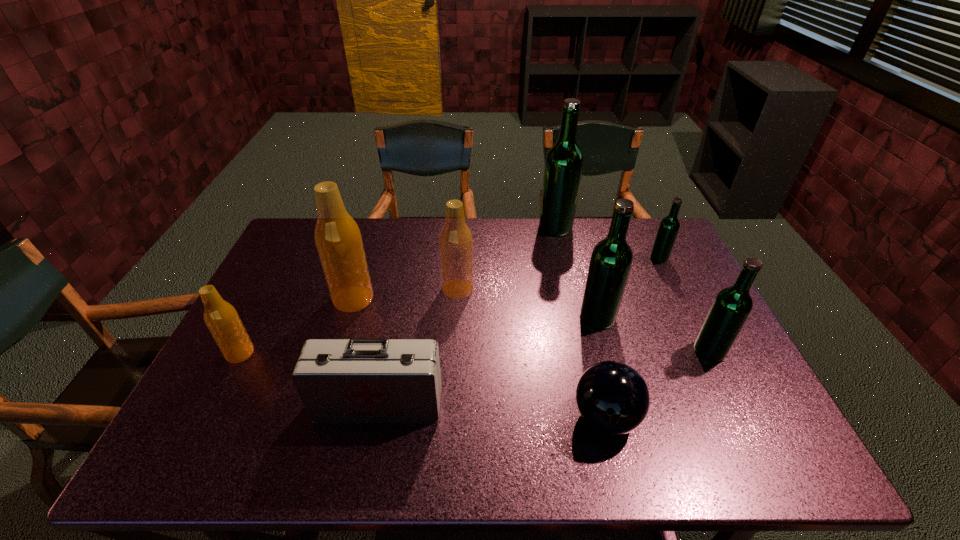
In order to click on free spot located on the right of the second smallest tan beer bottle in this screenshot , I will do `click(596, 289)`.

Where is `vacant point located 0.050m on the left of the sixth nearest beer bottle`? vacant point located 0.050m on the left of the sixth nearest beer bottle is located at coordinates (635, 259).

You are a GUI agent. You are given a task and a screenshot of the screen. Output one action in this format:
    pyautogui.click(x=<x>, y=<y>)
    Task: Click on the vacant region located on the back of the leftmost tan beer bottle
    Image resolution: width=960 pixels, height=540 pixels.
    Given the screenshot: What is the action you would take?
    pyautogui.click(x=291, y=256)

Locate an element on the screen. Image resolution: width=960 pixels, height=540 pixels. vacant space located on the front-facing side of the eighth tallest object is located at coordinates (369, 451).

The width and height of the screenshot is (960, 540). I want to click on object located in the near edge section of the desktop, so click(x=612, y=397).

This screenshot has height=540, width=960. What are the coordinates of `object that is at the left edge` in the screenshot? It's located at (221, 318).

I want to click on object positioned at the far right corner, so click(x=669, y=226).

Image resolution: width=960 pixels, height=540 pixels. In order to click on blank space at the far edge of the desktop in this screenshot , I will do `click(427, 230)`.

Find the location of `free spot at the near edge of the desktop`. free spot at the near edge of the desktop is located at coordinates (643, 447).

Find the location of `free space at the left edge of the desktop`. free space at the left edge of the desktop is located at coordinates (300, 305).